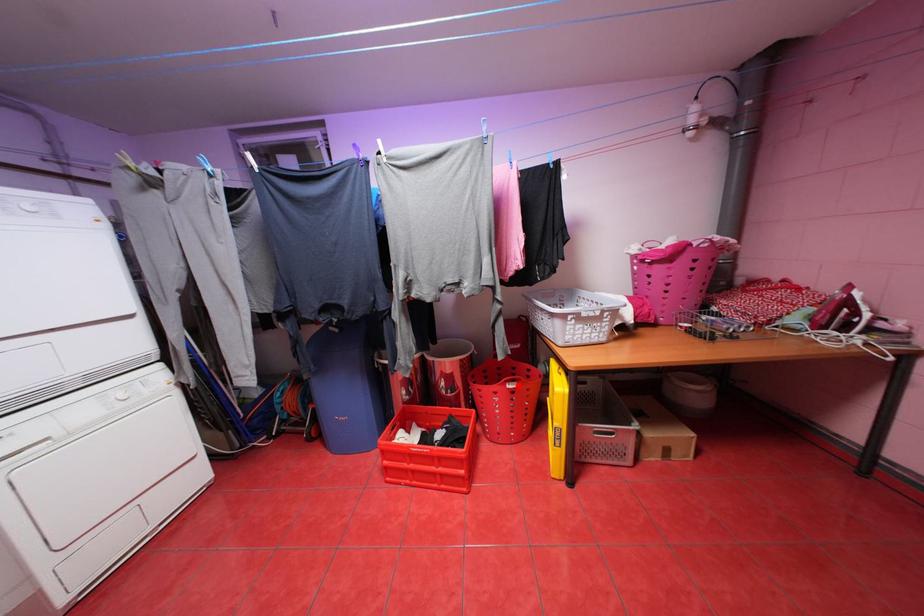
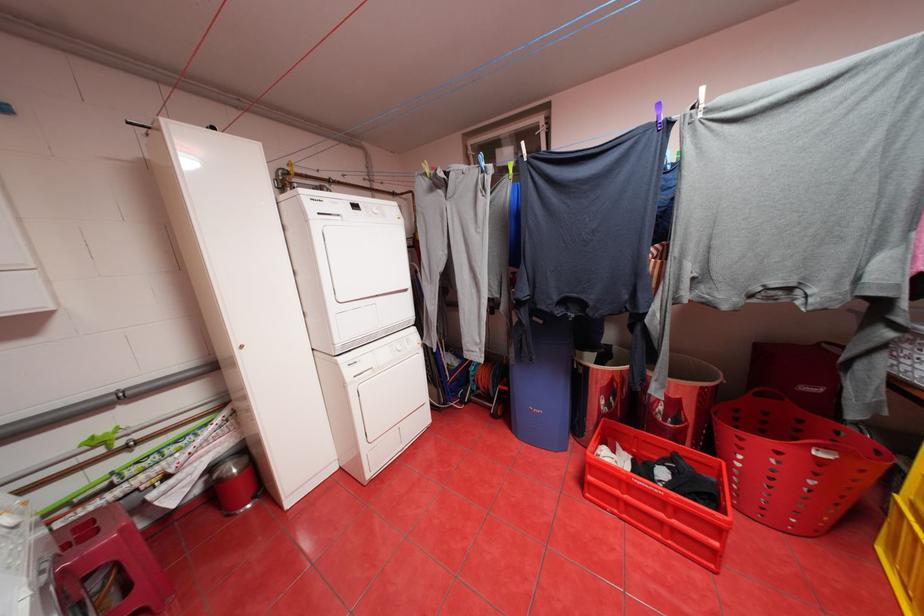
Question: I am providing you with two images of the same scene from different viewpoints. Image1 has a red point marked. In image2, the corresponding 3D location appears at what relative position? Reply with the corresponding letter.

Choices:
 (A) Closer
 (B) Farther

Answer: (A)